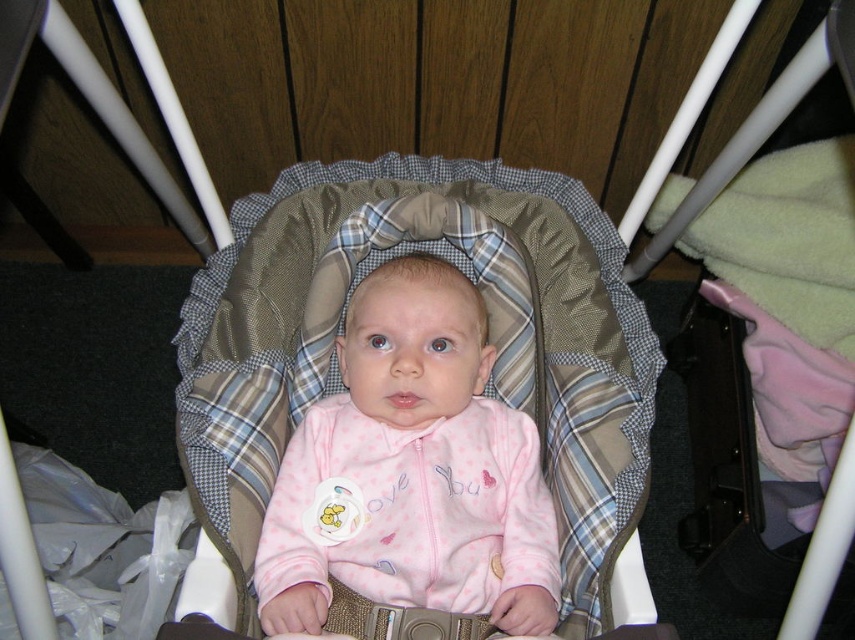
Who is shorter, plaid fabric infant bed at center or pink fleece baby at center?

With less height is pink fleece baby at center.

Does point (246, 321) come behind point (531, 458)?

Yes, it is.

Locate an element on the screen. plaid fabric infant bed at center is located at coordinates (490, 337).